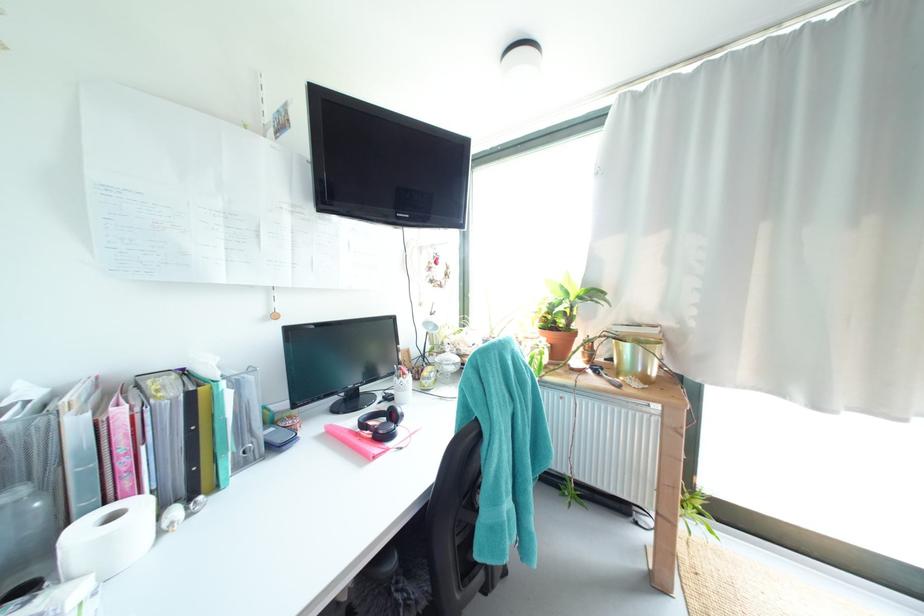
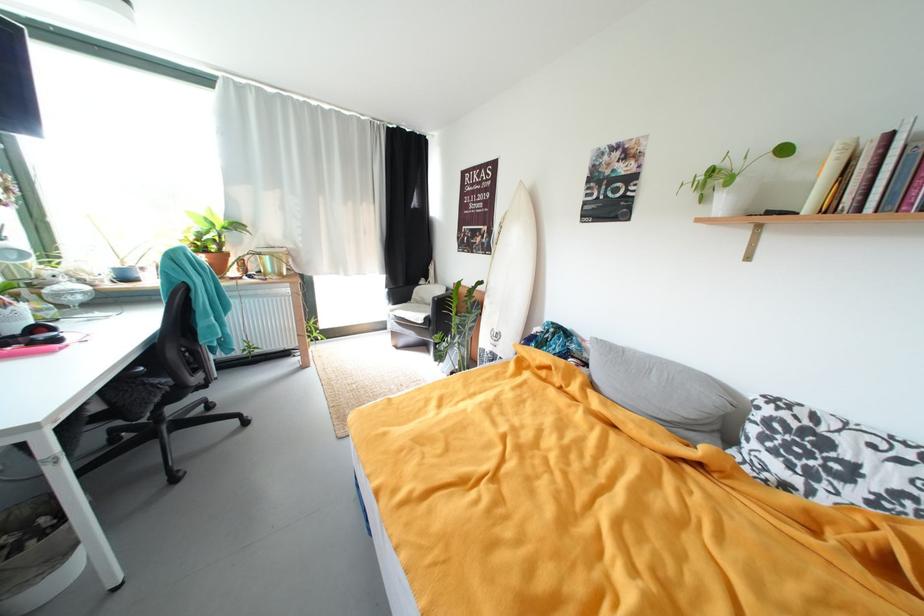
The point at (647, 322) is marked in the first image. Where is the corresponding point in the second image?

(281, 246)